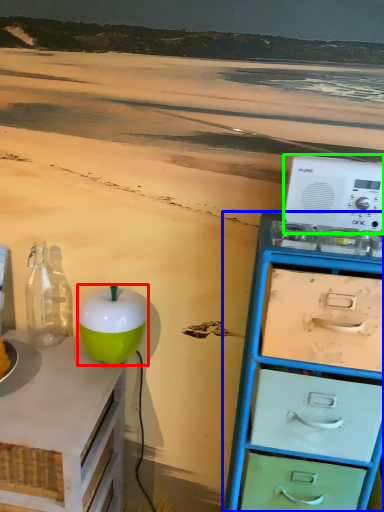
Question: Which object is positioned farthest from teal (highlighted by a red box)? Select from chest of drawers (highlighted by a blue box) and appliance (highlighted by a green box).

Choices:
 (A) chest of drawers
 (B) appliance

Answer: (B)